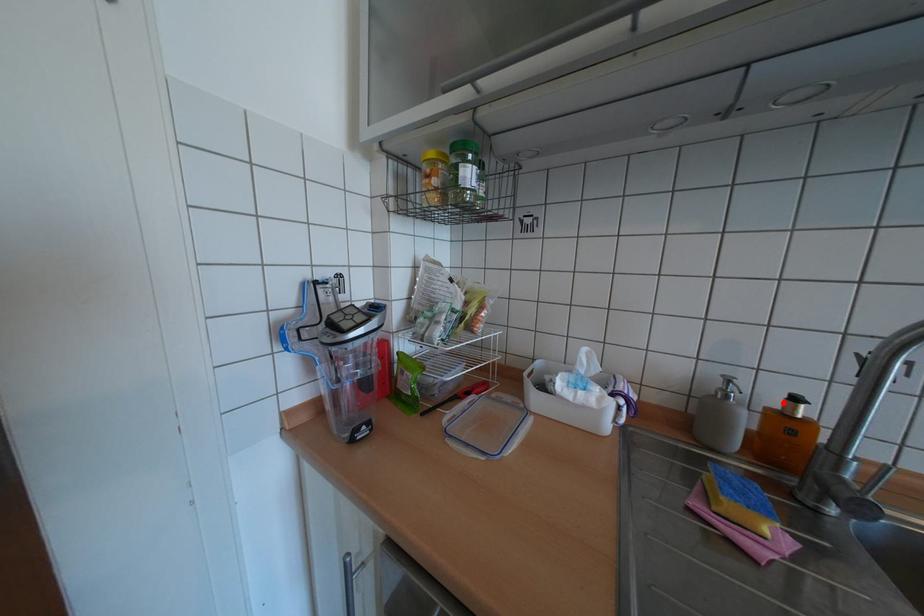
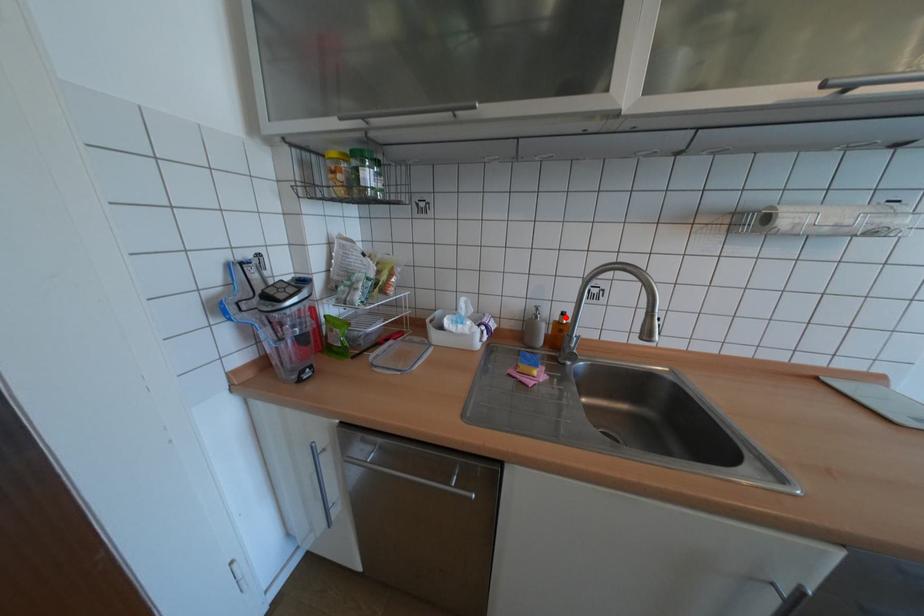
I am providing you with two images of the same scene from different viewpoints. A red point is marked on the first image and another point is marked on the second image. Does the point marked in image1 correspond to the same location as the one in image2?

Yes